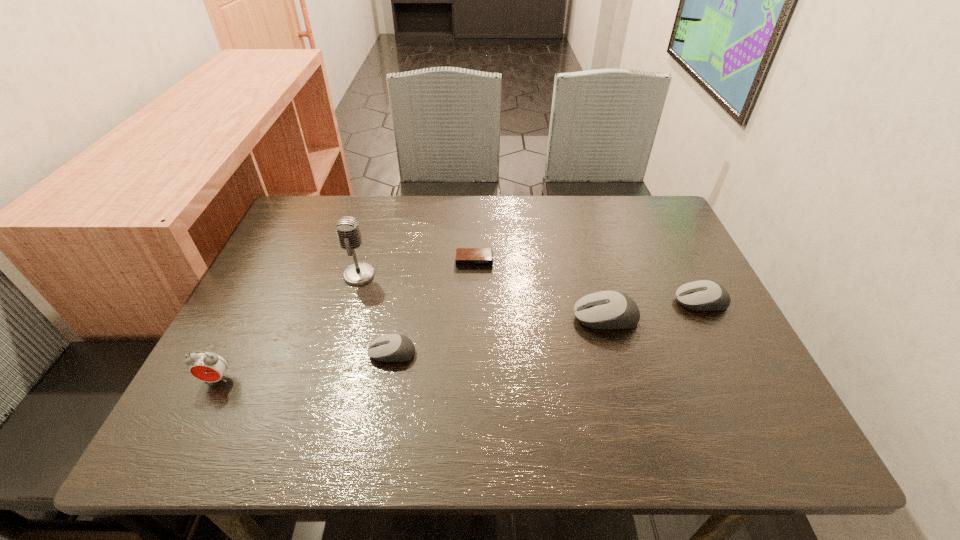
You are a GUI agent. You are given a task and a screenshot of the screen. Output one action in this format:
    pyautogui.click(x=<x>, y=<y>)
    Task: Click on the vacant area situated on the wheel side of the third shortest object
    
    Given the screenshot: What is the action you would take?
    pyautogui.click(x=574, y=302)

What are the coordinates of `vacant region located 0.120m on the front of the fifth object from right to left` in the screenshot? It's located at 346,322.

Find the location of a particular element. blank space located on the front face of the farther alarm clock is located at coordinates (473, 354).

Where is `object present at the near edge`? This screenshot has height=540, width=960. object present at the near edge is located at coordinates [206, 366].

Identify the location of object that is at the left edge. (206, 366).

I want to click on object that is at the right edge, so click(703, 295).

Locate an element on the screen. object that is at the near left corner is located at coordinates (206, 366).

This screenshot has height=540, width=960. In the image, there is a desktop. Identify the location of free space at the far edge. (418, 212).

Find the location of `free space at the near edge of the desktop`. free space at the near edge of the desktop is located at coordinates (376, 393).

What are the coordinates of `free point at the left edge` in the screenshot? It's located at point(246,300).